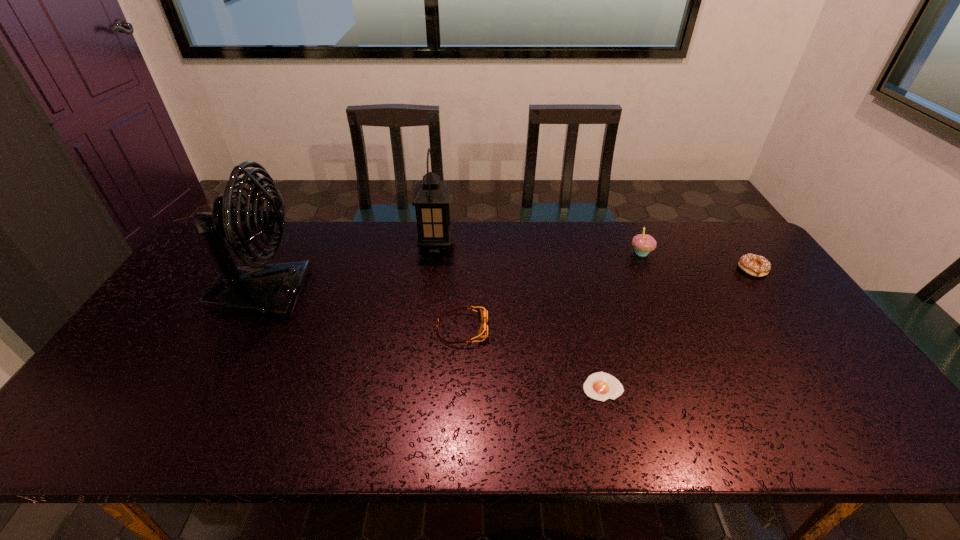
Identify the location of free spot between the rightmost object and the tallest object. Image resolution: width=960 pixels, height=540 pixels. (508, 282).

You are a GUI agent. You are given a task and a screenshot of the screen. Output one action in this format:
    pyautogui.click(x=<x>, y=<y>)
    Task: Click on the free space between the fifth object from left to right and the egg yolk
    This screenshot has height=540, width=960.
    Given the screenshot: What is the action you would take?
    pyautogui.click(x=622, y=320)

You are a GUI agent. You are given a task and a screenshot of the screen. Output one action in this format:
    pyautogui.click(x=<x>, y=<y>)
    Task: Click on the free space that is in between the second object from right to left and the goggles
    The width and height of the screenshot is (960, 540).
    Given the screenshot: What is the action you would take?
    pyautogui.click(x=552, y=291)

In order to click on vacant space that is in between the doughnut and the fourth object from left to right in this screenshot , I will do [x=678, y=328].

Where is `vacant point located between the fourth shortest object and the rightmost object`? This screenshot has width=960, height=540. vacant point located between the fourth shortest object and the rightmost object is located at coordinates pyautogui.click(x=697, y=261).

At what (x,y) coordinates should I click in order to perform the action: click on empty space that is in between the goggles and the egg yolk. Please return your answer as a coordinate pair (x, y). The image size is (960, 540). Looking at the image, I should click on (532, 358).

Identify the location of empty space between the lantern and the third object from right to left. Image resolution: width=960 pixels, height=540 pixels. (519, 316).

You are a GUI agent. You are given a task and a screenshot of the screen. Output one action in this format:
    pyautogui.click(x=<x>, y=<y>)
    Task: Click on the free space between the lantern and the goggles
    Image resolution: width=960 pixels, height=540 pixels.
    Given the screenshot: What is the action you would take?
    pyautogui.click(x=449, y=287)

You are a GUI agent. You are given a task and a screenshot of the screen. Output one action in this format:
    pyautogui.click(x=<x>, y=<y>)
    Task: Click on the object identified as the fourth closest to the cupcake
    The image size is (960, 540).
    Given the screenshot: What is the action you would take?
    pyautogui.click(x=431, y=196)

In order to click on object that is the closest to the goggles in this screenshot , I will do [x=600, y=386].